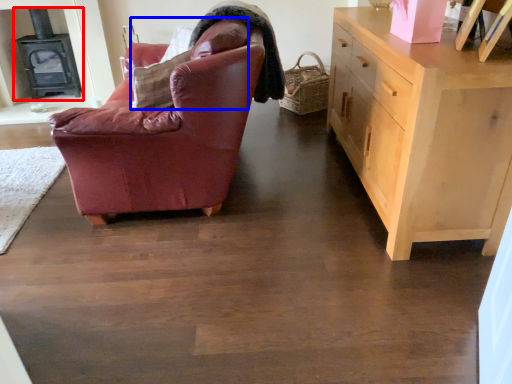
Question: Which object appears farthest to the camera in this image, fireplace (highlighted by a red box) or pillow (highlighted by a blue box)?

Choices:
 (A) fireplace
 (B) pillow

Answer: (A)